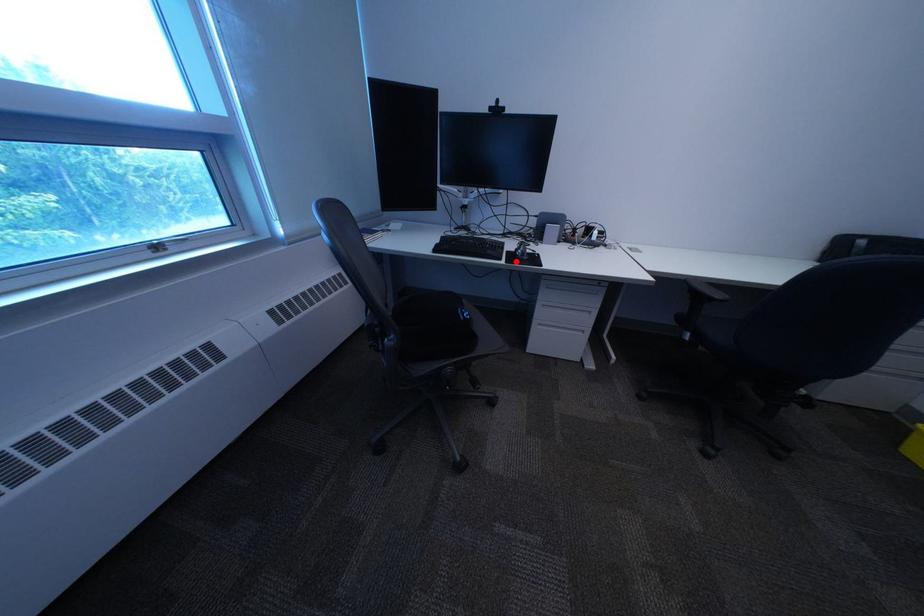
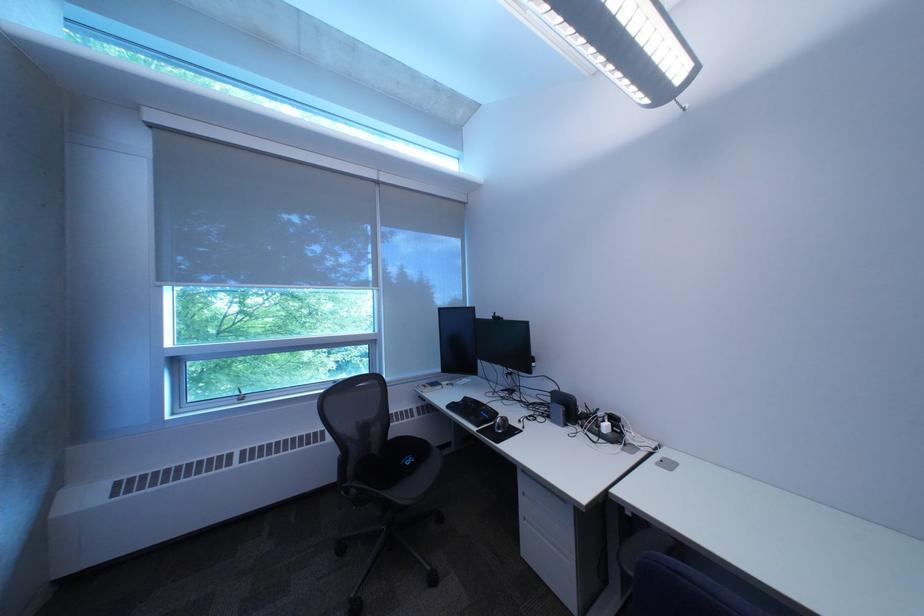
Question: I am providing you with two images of the same scene from different viewpoints. A red point is shown in image1. For the corresponding object point in image2, is it positioned nearer or farther from the camera?

Choices:
 (A) Nearer
 (B) Farther

Answer: (B)